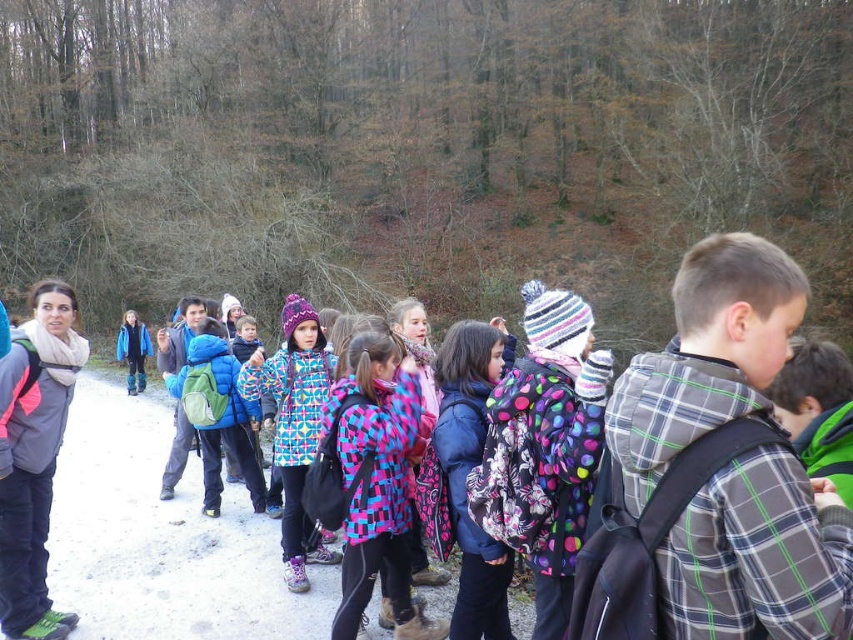
Question: Which point is closer to the camera?

Choices:
 (A) pink checkered jacket at center
 (B) polka dot scarf at center

Answer: (B)

Question: Does matte gray jacket at left appear over polka dot scarf at center?

Choices:
 (A) yes
 (B) no

Answer: (A)

Question: Considering the real-world distances, which object is farthest from the multicolored quilted jacket at center?

Choices:
 (A) pink checkered jacket at center
 (B) matte gray jacket at left

Answer: (B)

Question: Which point appears farthest from the camera in this image?

Choices:
 (A) (288, 500)
 (B) (664, 419)
 (C) (33, 417)

Answer: (A)

Question: Is pink checkered jacket at center to the left of multicolored quilted jacket at center from the viewer's perspective?

Choices:
 (A) no
 (B) yes

Answer: (A)

Question: Does matte gray jacket at left have a smaller size compared to multicolored quilted jacket at center?

Choices:
 (A) no
 (B) yes

Answer: (B)